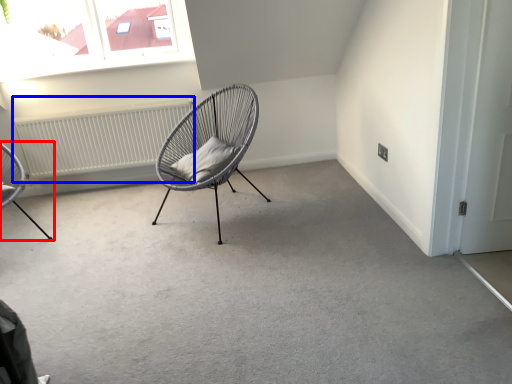
Question: Which point is closer to the camera, chair (highlighted by a red box) or radiator (highlighted by a blue box)?

Choices:
 (A) chair
 (B) radiator

Answer: (A)